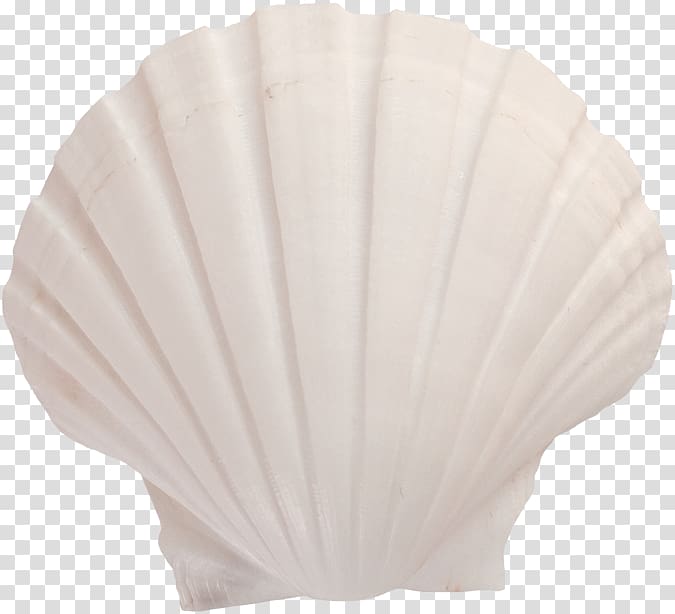
The height and width of the screenshot is (614, 675). Identify the location of lower left tile background. (74, 535).